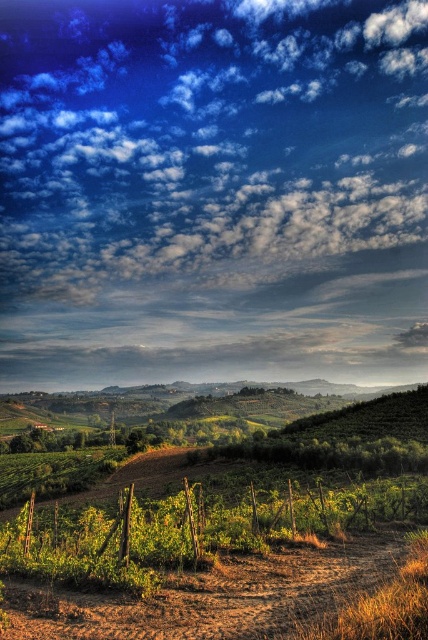
You are standing in the vineyard and looking towards the point marked at coordinates (213, 189). What do you see at that point?

At point (213, 189), there is cloudy sky at upper center.

You are a photographer planning to capture the vineyard landscape. You notice the cloudy sky at upper center and the green wire fence at lower center. Which object is located higher in the image?

The cloudy sky at upper center is positioned over the green wire fence at lower center, so it is higher in the image.

You are a landscape photographer planning to capture the cloudy sky at upper center and the green wire fence at lower center in a single frame. Given their sizes, which object will occupy more of the camera view?

The cloudy sky at upper center is larger in size than the green wire fence at lower center, so it will occupy more of the camera view.